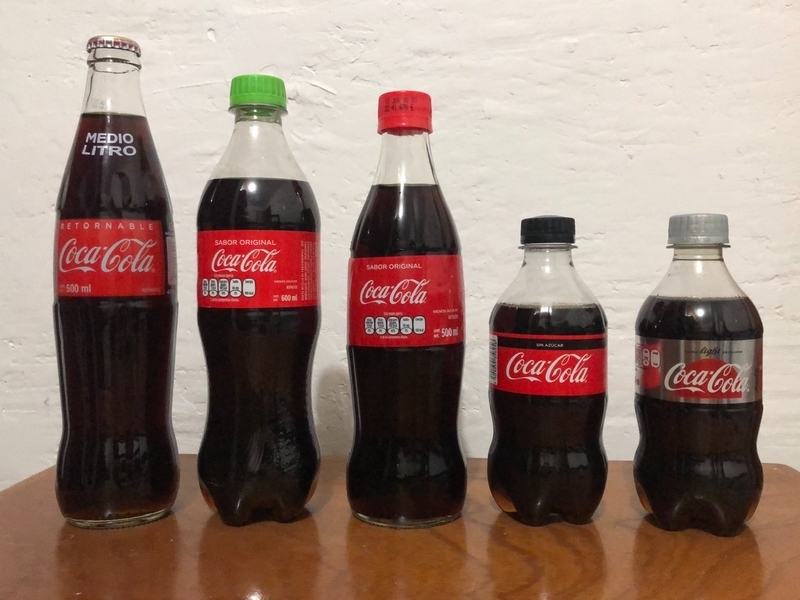
Where is `bottle lids`? The image size is (800, 600). bottle lids is located at coordinates (116, 41), (258, 83), (400, 105), (564, 230), (710, 227).